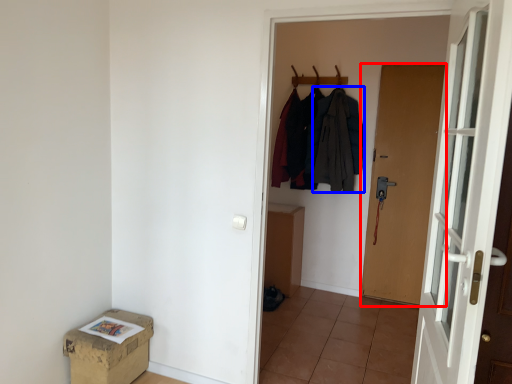
Question: Which object appears closest to the camera in this image, door (highlighted by a red box) or clothing (highlighted by a blue box)?

Choices:
 (A) door
 (B) clothing

Answer: (A)